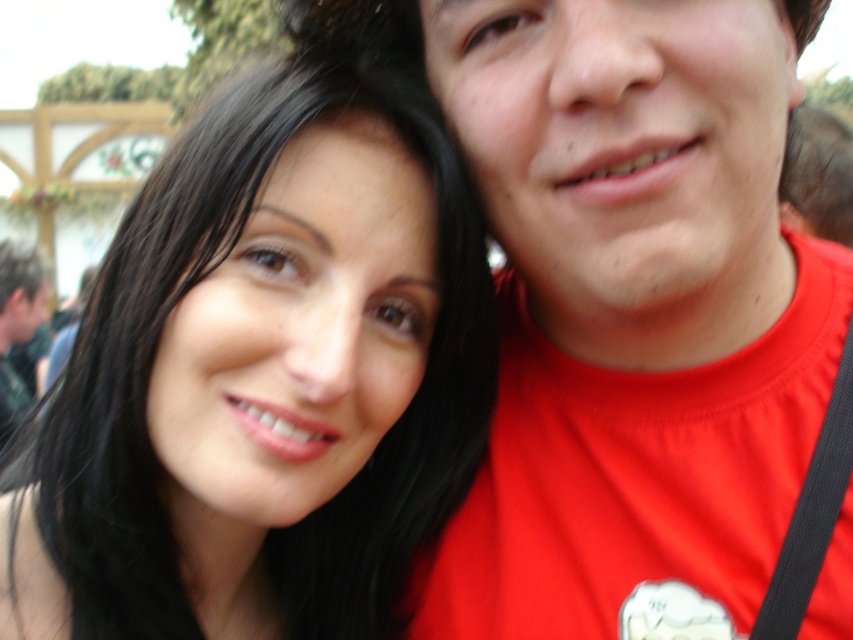
Question: Can you confirm if smooth black hair at upper left is thinner than matte red shirt at right?

Choices:
 (A) yes
 (B) no

Answer: (A)

Question: Which of the following is the closest to the observer?

Choices:
 (A) matte red shirt at right
 (B) smooth black hair at upper left

Answer: (A)

Question: Which point is closer to the camera taking this photo?

Choices:
 (A) (212, 358)
 (B) (790, 337)

Answer: (A)

Question: Is smooth black hair at upper left above matte red shirt at right?

Choices:
 (A) no
 (B) yes

Answer: (A)

Question: Is smooth black hair at upper left positioned before matte red shirt at right?

Choices:
 (A) yes
 (B) no

Answer: (B)